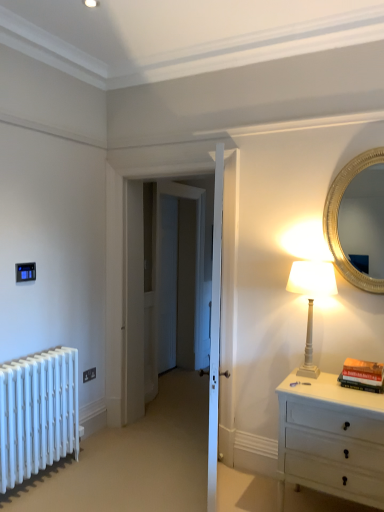
You are a GUI agent. You are given a task and a screenshot of the screen. Output one action in this format:
    pyautogui.click(x=<x>, y=<y>)
    Task: Click on the free point above white glossy table lamp at right (from a real-world perspective)
    
    Given the screenshot: What is the action you would take?
    pyautogui.click(x=319, y=261)